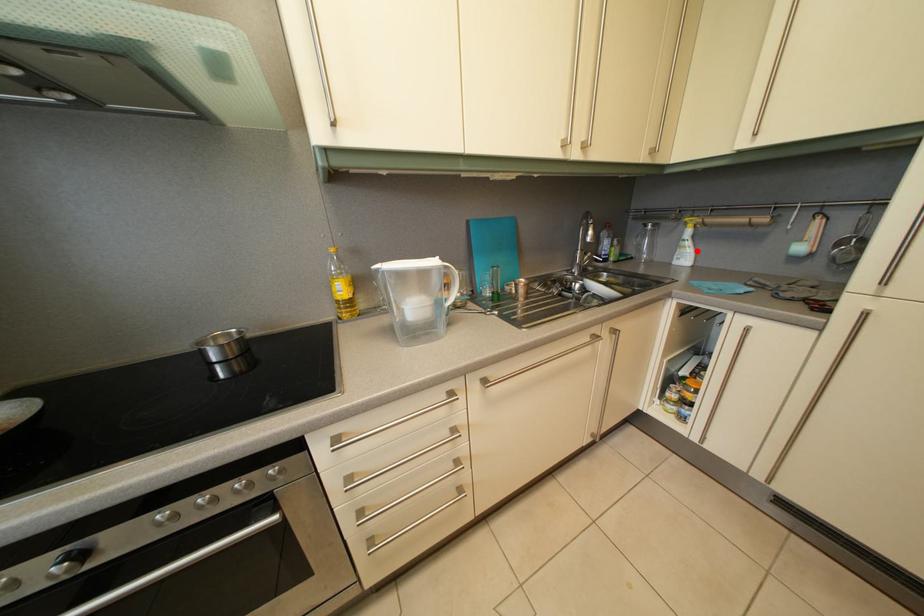
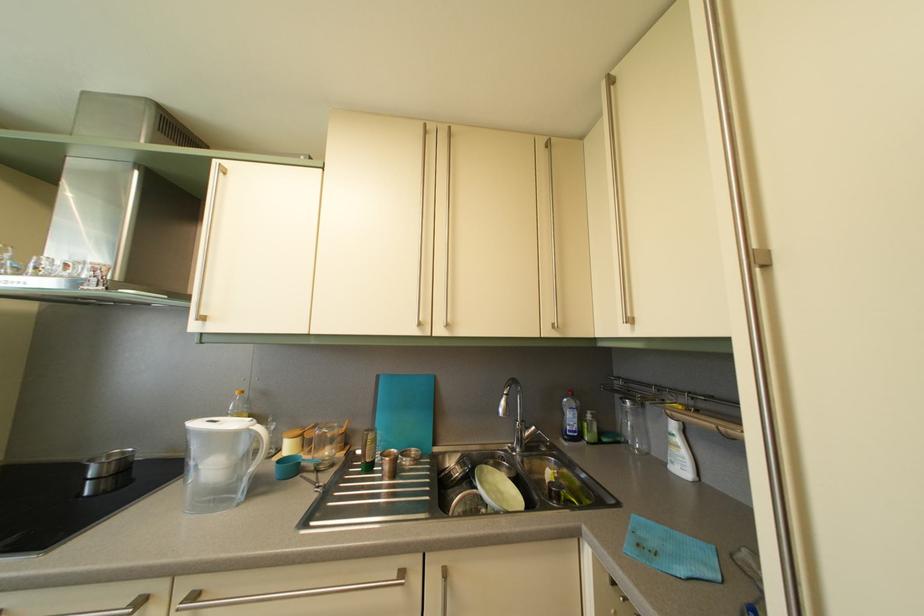
Question: A red point is marked in image1. In image2, is the corresponding 3D point closer to the camera or farther? Reply with the corresponding letter.

Choices:
 (A) The corresponding 3D point is closer.
 (B) The corresponding 3D point is farther.

Answer: (B)